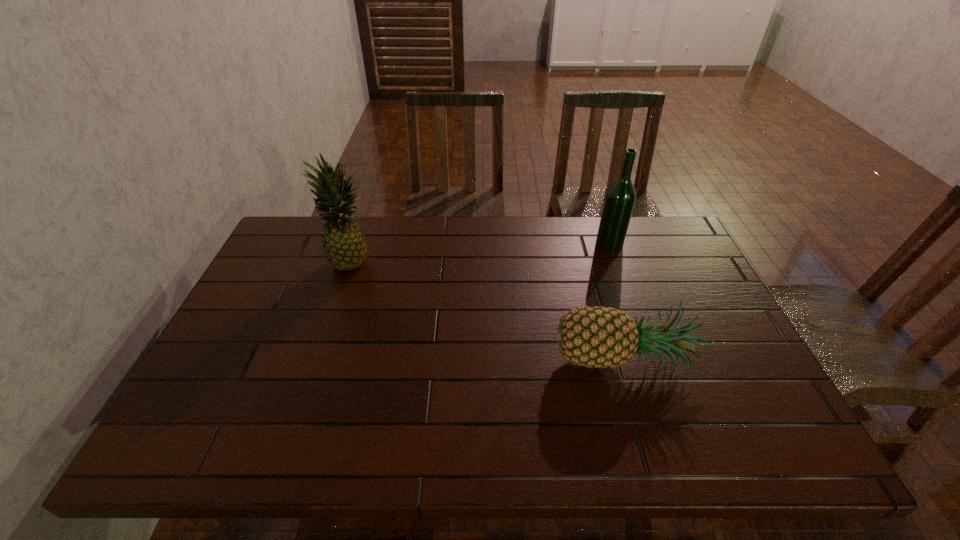
Locate an element on the screen. The image size is (960, 540). the taller pineapple is located at coordinates (345, 248).

Find the location of `the left pineapple`. the left pineapple is located at coordinates (345, 248).

Locate an element on the screen. The width and height of the screenshot is (960, 540). alcohol is located at coordinates (620, 197).

This screenshot has width=960, height=540. What are the coordinates of `the nearer pineapple` in the screenshot? It's located at (599, 337).

This screenshot has height=540, width=960. Identify the location of the shorter pineapple. (599, 337).

The width and height of the screenshot is (960, 540). Identify the location of vacant space located on the right of the left pineapple. (439, 259).

Identify the location of vacant space located 0.300m on the front of the alcohol. (637, 322).

Find the location of a particular element. The height and width of the screenshot is (540, 960). vacant space located 0.230m on the left of the shortest object is located at coordinates (460, 362).

Find the location of `pineapple positioned at the far edge`. pineapple positioned at the far edge is located at coordinates (345, 248).

Identify the location of alcohol present at the far edge. The height and width of the screenshot is (540, 960). (620, 197).